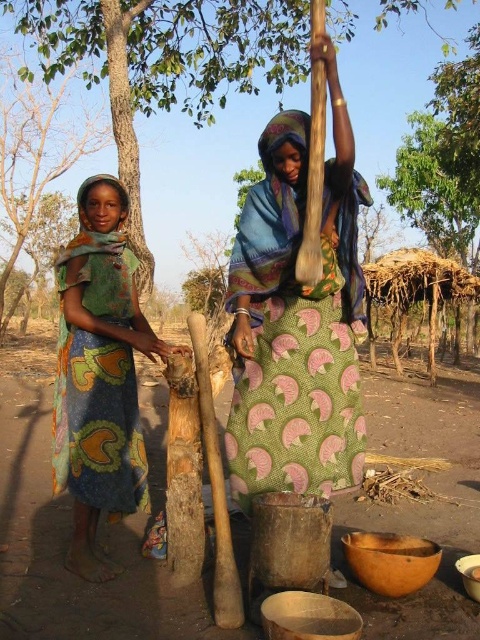
Does green patterned cloth at center have a larger size compared to green printed dress at left?

No.

How much distance is there between green patterned cloth at center and green printed dress at left?

green patterned cloth at center and green printed dress at left are 25.11 inches apart.

Which is in front, point (286, 404) or point (84, 317)?

Point (286, 404)

This screenshot has width=480, height=640. I want to click on green patterned cloth at center, so click(x=298, y=317).

Can you confirm if green patterned cloth at center is positioned above green leafy tree at center?

No, green patterned cloth at center is not above green leafy tree at center.

Is point (305, 116) behind point (403, 76)?

No, it is in front of (403, 76).

This screenshot has width=480, height=640. I want to click on green patterned cloth at center, so click(x=298, y=317).

Locate an element on the screen. The image size is (480, 640). green patterned cloth at center is located at coordinates point(298,317).

Is point (45, 33) less distant than point (66, 259)?

No.

Which of these two, green leafy tree at center or green printed dress at left, stands taller?

With more height is green leafy tree at center.

Does point (143, 131) lie in front of point (127, 336)?

No, it is behind (127, 336).

The height and width of the screenshot is (640, 480). I want to click on green leafy tree at center, so click(171, 51).